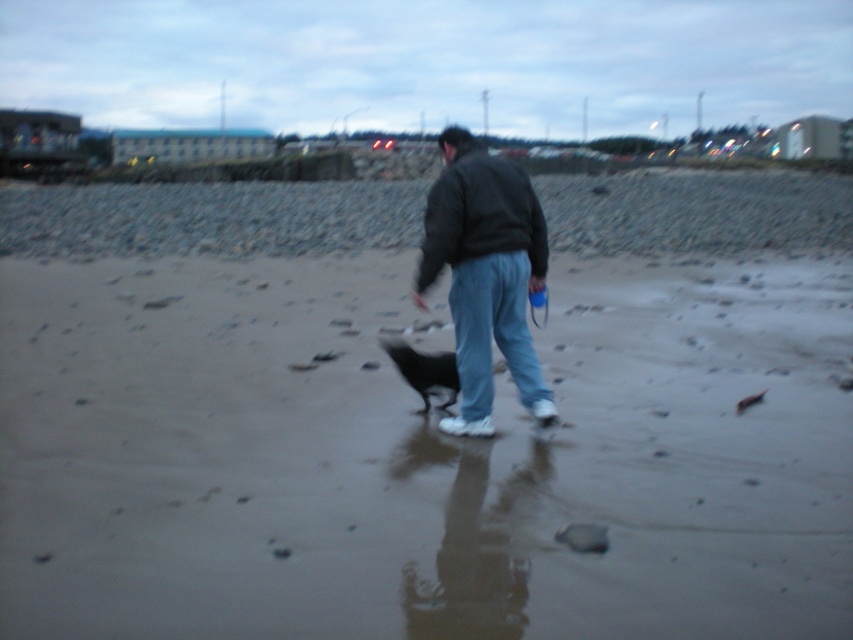
Between dark gray jacket at center and dark gray fleece sweatshirt at center, which one appears on the left side from the viewer's perspective?

dark gray fleece sweatshirt at center is more to the left.

Between dark gray jacket at center and dark gray fleece sweatshirt at center, which one has more height?

dark gray jacket at center

Identify the location of dark gray jacket at center. The height and width of the screenshot is (640, 853). tap(485, 275).

The height and width of the screenshot is (640, 853). I want to click on dark gray jacket at center, so click(485, 275).

How far apart are smooth sand beach at center and black fur dog at center?

5.67 meters

Between point (62, 392) and point (393, 339), which one is positioned in front?

Point (62, 392) is more forward.

Does point (694, 464) come closer to viewer compared to point (427, 368)?

Yes, it is.

You are a GUI agent. You are given a task and a screenshot of the screen. Output one action in this format:
    pyautogui.click(x=<x>, y=<y>)
    Task: Click on the smooth sand beach at center
    
    Given the screenshot: What is the action you would take?
    pyautogui.click(x=422, y=417)

Is point (524, 188) closer to viewer compared to point (386, 340)?

Yes, it is.

Is the position of dark gray fleece sweatshirt at center more distant than that of black fur dog at center?

No, it is in front of black fur dog at center.

Is point (463, 193) more distant than point (387, 346)?

No.

Image resolution: width=853 pixels, height=640 pixels. In order to click on dark gray fleece sweatshirt at center in this screenshot , I will do `click(479, 212)`.